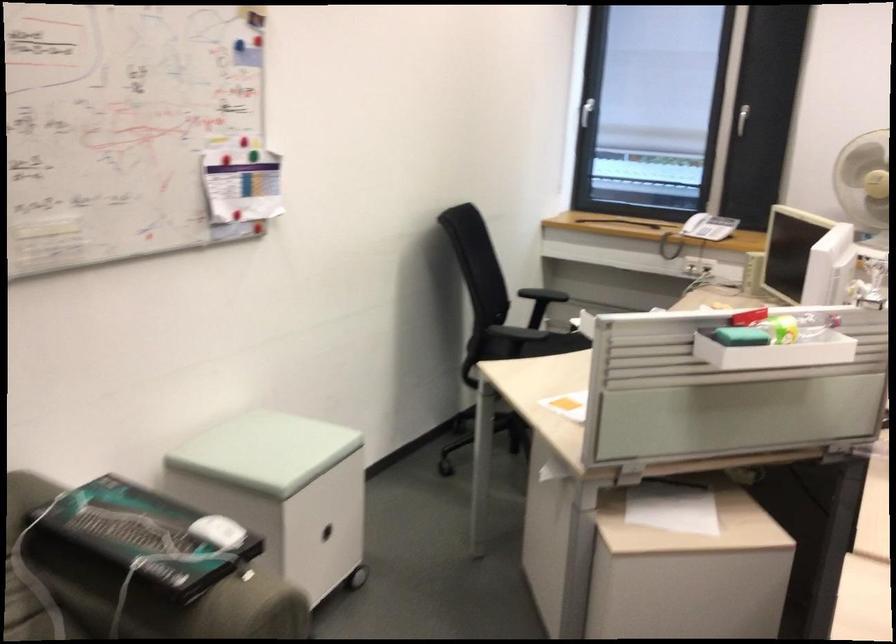
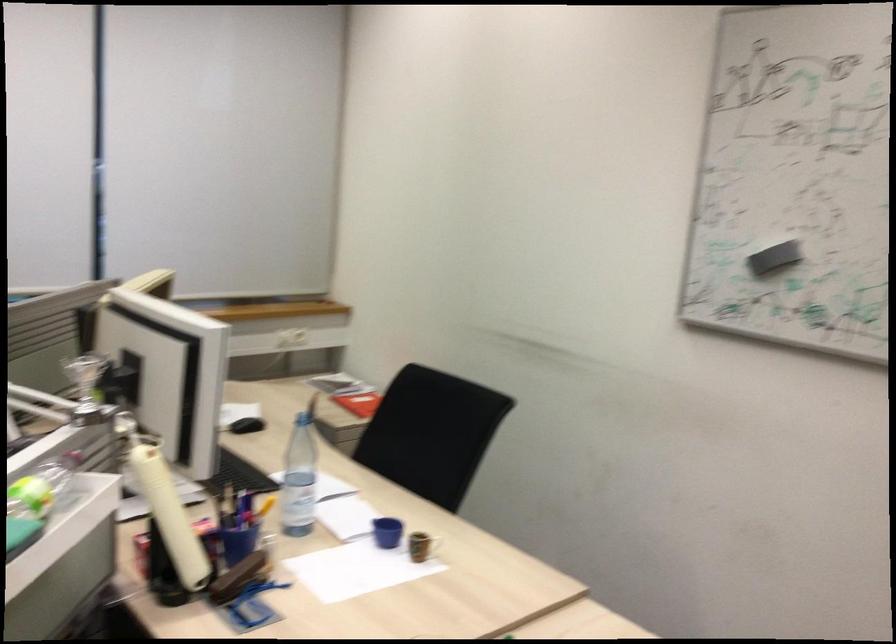
Question: Based on the continuous images, in which direction is the camera rotating? Reply with the corresponding letter.

Choices:
 (A) Left
 (B) Right
 (C) Up
 (D) Down

Answer: (B)